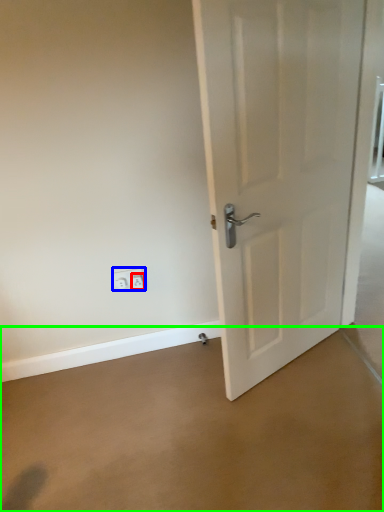
Question: Which object is positioned closest to electric outlet (highlighted by a red box)? Select from electric outlet (highlighted by a blue box) and concrete (highlighted by a green box).

Choices:
 (A) electric outlet
 (B) concrete

Answer: (A)